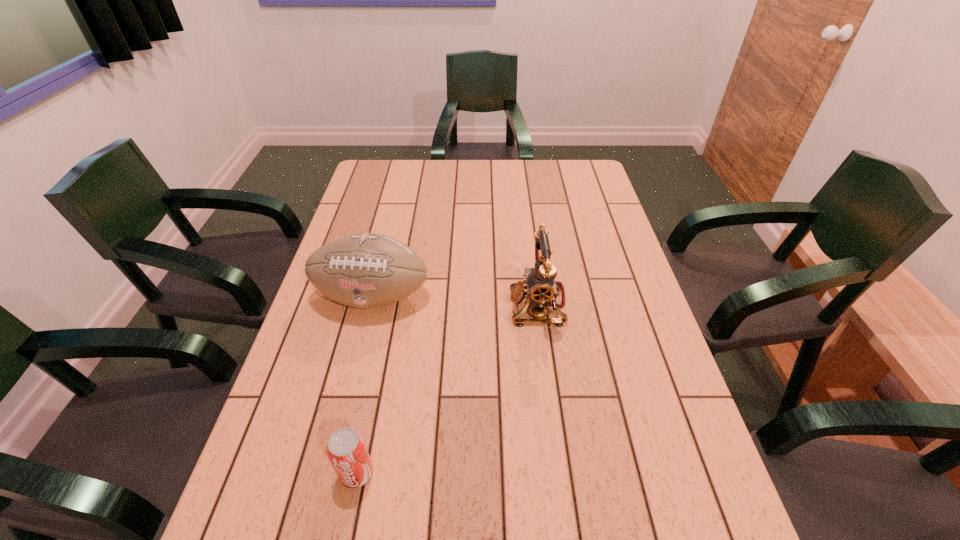
Find the location of `object at the left edge`. object at the left edge is located at coordinates click(x=363, y=270).

Where is `free space at the far edge of the desktop`? The height and width of the screenshot is (540, 960). free space at the far edge of the desktop is located at coordinates (469, 177).

In the image, there is a desktop. Where is `vacant region at the left edge`? vacant region at the left edge is located at coordinates (391, 234).

In the image, there is a desktop. Identify the location of free space at the right edge. The image size is (960, 540). (596, 193).

I want to click on vacant space at the far left corner of the desktop, so click(379, 175).

I want to click on free space between the shortest object and the football (American), so point(365,385).

The width and height of the screenshot is (960, 540). Find the location of `empty space that is in between the rightmost object and the soda can`. empty space that is in between the rightmost object and the soda can is located at coordinates (447, 389).

Find the location of a particular element. free space between the rightmost object and the soda can is located at coordinates (447, 389).

Locate an element on the screen. unoccupied area between the second shortest object and the soda can is located at coordinates (365, 385).

The width and height of the screenshot is (960, 540). Identify the location of empty space between the rightmost object and the nearest object. (447, 389).